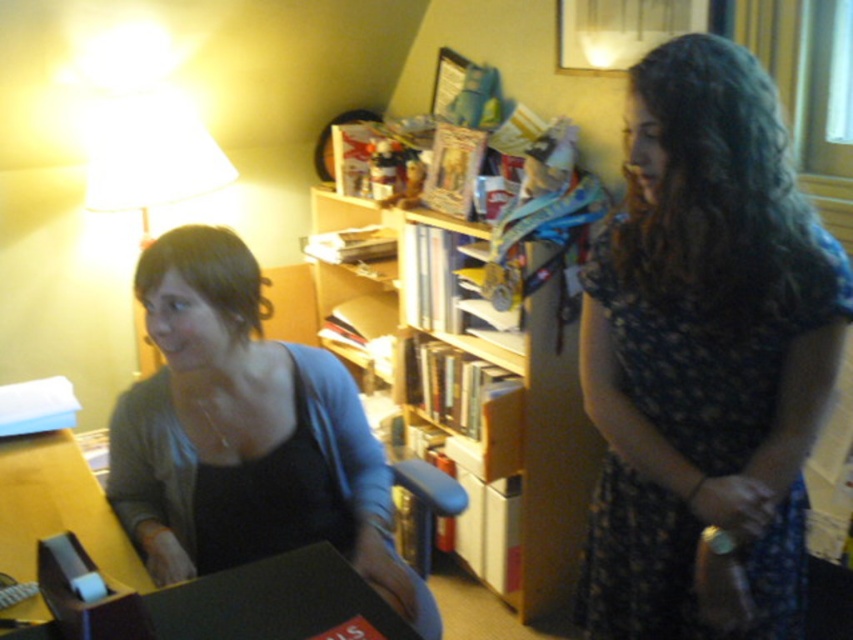
You are organizing a photoshoot and need to ensure proper lighting. The scene has two subjects wearing a dark floral dress at right and a matte black shirt at left. Based on their positions, which subject might require additional lighting adjustments to avoid appearing too dark in the final image?

The matte black shirt at left might require additional lighting adjustments since it is positioned below the dark floral dress at right, potentially receiving less light from the lamp on the left side of the frame.

You are organizing a small party in the room and need to place a 1.2 meter long tablecloth. Considering the space between the matte black shirt at left and the wooden bookshelf at center, will it fit?

The matte black shirt at left is smaller than the wooden bookshelf at center, but the description does not provide information about the distance between them. Therefore, it is impossible to determine if the tablecloth will fit based on the given details.